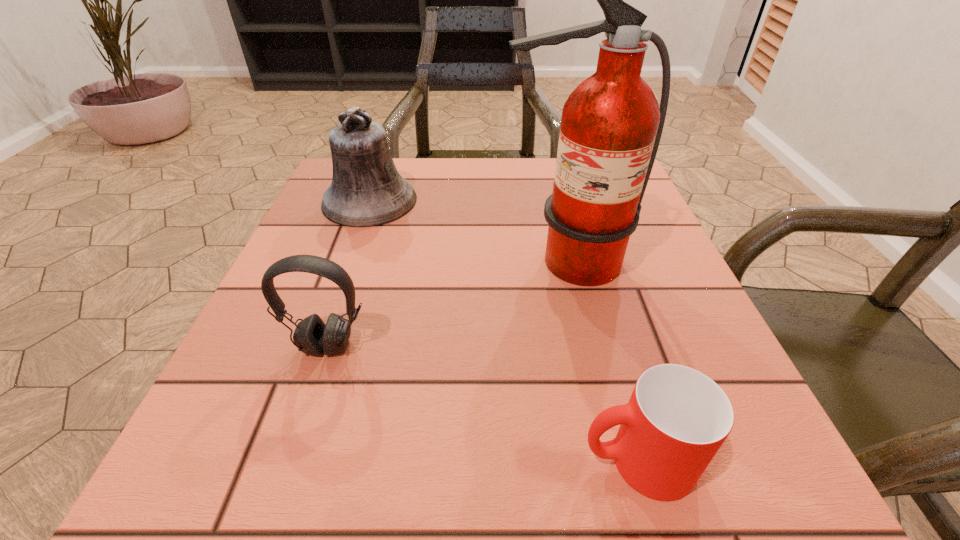
The image size is (960, 540). In order to click on free point located 0.140m on the front-facing side of the third farthest object in this screenshot , I will do `click(293, 450)`.

At what (x,y) coordinates should I click in order to perform the action: click on blank area located 0.160m on the side of the nearest object with the handle. Please return your answer as a coordinate pair (x, y). The image size is (960, 540). Looking at the image, I should click on (448, 461).

Find the location of `vacant space located on the side of the nearest object with the handle`. vacant space located on the side of the nearest object with the handle is located at coordinates pyautogui.click(x=390, y=461).

Locate an element on the screen. The width and height of the screenshot is (960, 540). vacant space situated on the side of the nearest object with the handle is located at coordinates (540, 461).

Identify the location of object that is at the far edge. (366, 190).

Locate an element on the screen. object at the near edge is located at coordinates 677,418.

Find the location of a particular element. The width and height of the screenshot is (960, 540). bell that is at the left edge is located at coordinates (366, 190).

Locate an element on the screen. The height and width of the screenshot is (540, 960). headset located in the left edge section of the desktop is located at coordinates click(311, 336).

Where is `fire extinguisher present at the right edge`? This screenshot has width=960, height=540. fire extinguisher present at the right edge is located at coordinates (611, 125).

The image size is (960, 540). In order to click on cup that is at the right edge in this screenshot , I will do `click(677, 418)`.